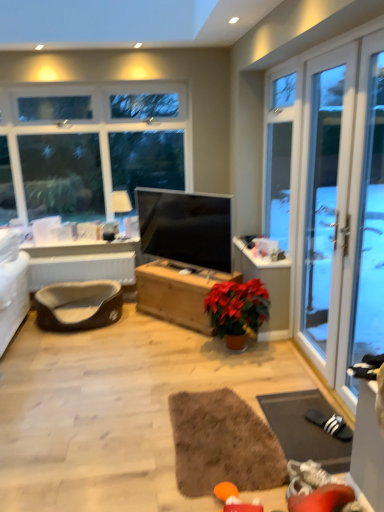
Question: Can you confirm if transparent glass screen door at right is taller than brown fabric pet bed at lower left?

Choices:
 (A) yes
 (B) no

Answer: (A)

Question: Does transparent glass screen door at right have a lesser width compared to brown fabric pet bed at lower left?

Choices:
 (A) no
 (B) yes

Answer: (A)

Question: Can you confirm if transparent glass screen door at right is positioned to the left of brown fabric pet bed at lower left?

Choices:
 (A) yes
 (B) no

Answer: (B)

Question: From a real-world perspective, is transparent glass screen door at right beneath brown fabric pet bed at lower left?

Choices:
 (A) no
 (B) yes

Answer: (A)

Question: Is transparent glass screen door at right not near brown fabric pet bed at lower left?

Choices:
 (A) yes
 (B) no

Answer: (A)

Question: Is wooden chest at center bigger or smaller than transparent glass screen door at right?

Choices:
 (A) big
 (B) small

Answer: (B)

Question: Based on their positions, is wooden chest at center located to the left or right of transparent glass screen door at right?

Choices:
 (A) left
 (B) right

Answer: (A)

Question: From the image's perspective, relative to transparent glass screen door at right, is wooden chest at center above or below?

Choices:
 (A) above
 (B) below

Answer: (B)

Question: Does point (152, 287) appear closer or farther from the camera than point (332, 380)?

Choices:
 (A) closer
 (B) farther

Answer: (B)

Question: Is brown fabric pet bed at lower left taller or shorter than matte white lampshade at upper left?

Choices:
 (A) tall
 (B) short

Answer: (A)

Question: In terms of size, does brown fabric pet bed at lower left appear bigger or smaller than matte white lampshade at upper left?

Choices:
 (A) small
 (B) big

Answer: (B)

Question: Does point tap(64, 257) appear closer or farther from the camera than point tap(125, 209)?

Choices:
 (A) farther
 (B) closer

Answer: (B)

Question: From the image's perspective, is brown fabric pet bed at lower left positioned above or below matte white lampshade at upper left?

Choices:
 (A) below
 (B) above

Answer: (A)

Question: In terms of height, does brown plush pet bed at lower left look taller or shorter compared to matte black tv at center?

Choices:
 (A) tall
 (B) short

Answer: (B)

Question: From the image's perspective, relative to matte black tv at center, is brown plush pet bed at lower left above or below?

Choices:
 (A) below
 (B) above

Answer: (A)